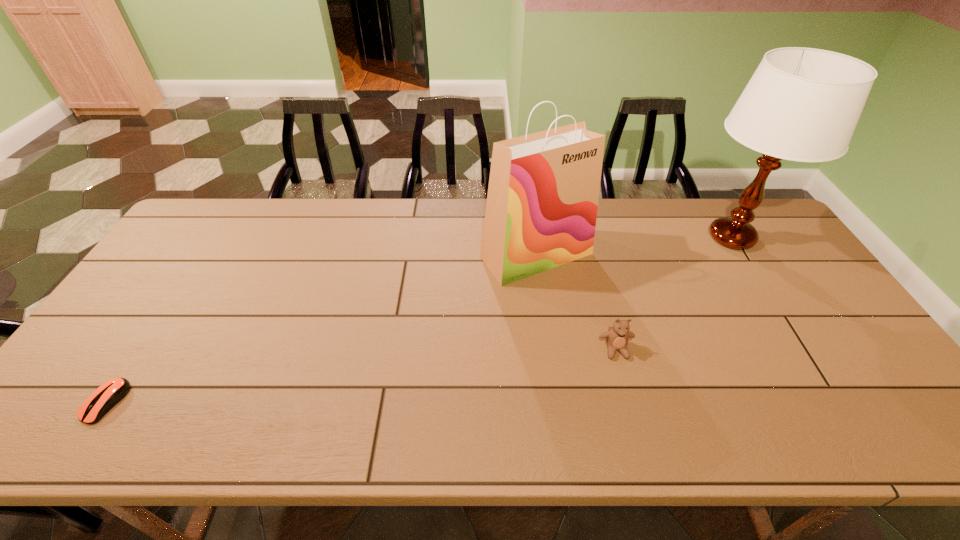
Where is `free space between the third farthest object and the rightmost object`? The height and width of the screenshot is (540, 960). free space between the third farthest object and the rightmost object is located at coordinates (674, 294).

The width and height of the screenshot is (960, 540). What are the coordinates of `unoccupied position between the rightmost object and the shopping bag` in the screenshot? It's located at (634, 246).

Identify which object is the second closest to the teddy bear. Please provide its 2D coordinates. Your answer should be formatted as a tuple, i.e. [(x, y)], where the tuple contains the x and y coordinates of a point satisfying the conditions above.

[(802, 104)]

Locate an element on the screen. This screenshot has height=540, width=960. the second closest object to the computer mouse is located at coordinates (617, 338).

This screenshot has height=540, width=960. What are the coordinates of `blank space that satisfies the following two spatial constraints: 1. on the back side of the shopping bag; 2. on the right side of the table lamp` in the screenshot? It's located at (534, 237).